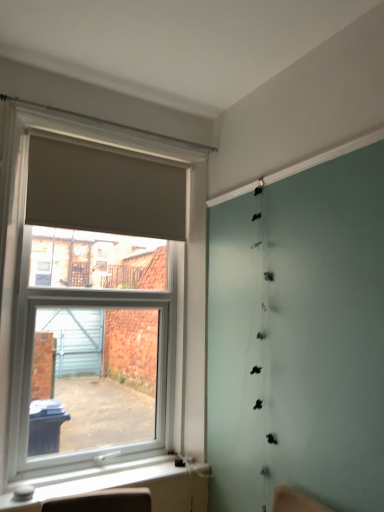
The width and height of the screenshot is (384, 512). In order to click on matte beige curtain at upper left in this screenshot , I will do `click(103, 191)`.

This screenshot has height=512, width=384. I want to click on matte gray roller blind at left, so (x=11, y=283).

Can you confirm if white plastic window sill at lower left is positioned to the left of matte gray roller blind at left?

No.

You are a GUI agent. You are given a task and a screenshot of the screen. Output one action in this format:
    pyautogui.click(x=<x>, y=<y>)
    Task: Click on the window above the white plastic window sill at lower left (from the image's perspective)
    
    Given the screenshot: What is the action you would take?
    pyautogui.click(x=11, y=283)

Could you tell me if white plastic window sill at lower left is facing matte gray roller blind at left?

No, white plastic window sill at lower left is not facing towards matte gray roller blind at left.

Considering the relative positions of matte gray roller blind at left and white plastic window sill at lower left in the image provided, is matte gray roller blind at left in front of white plastic window sill at lower left?

Yes, matte gray roller blind at left is closer to the camera.

From the image's perspective, who appears lower, matte gray roller blind at left or white plastic window sill at lower left?

From the image's view, white plastic window sill at lower left is below.

Does matte gray roller blind at left turn towards white plastic window sill at lower left?

No.

Is matte gray roller blind at left touching matte beige curtain at upper left?

matte gray roller blind at left and matte beige curtain at upper left are clearly separated.

Where is `window below the matte beige curtain at upper left (from a real-world perspective)`? The height and width of the screenshot is (512, 384). window below the matte beige curtain at upper left (from a real-world perspective) is located at coordinates (11, 283).

How many degrees apart are the facing directions of matte gray roller blind at left and matte beige curtain at upper left?

0.00287 degrees.

From a real-world perspective, does matte gray roller blind at left stand above matte beige curtain at upper left?

No, from a real-world perspective, matte gray roller blind at left is not above matte beige curtain at upper left.

Would you say matte beige curtain at upper left is outside white plastic window sill at lower left?

Yes.

Between matte beige curtain at upper left and white plastic window sill at lower left, which one has smaller width?

With smaller width is matte beige curtain at upper left.

From the image's perspective, does matte beige curtain at upper left appear higher than white plastic window sill at lower left?

Yes, from the image's perspective, matte beige curtain at upper left is over white plastic window sill at lower left.

Considering the relative positions of matte beige curtain at upper left and white plastic window sill at lower left in the image provided, is matte beige curtain at upper left to the right of white plastic window sill at lower left from the viewer's perspective?

In fact, matte beige curtain at upper left is to the left of white plastic window sill at lower left.

I want to click on window sill that is under the matte beige curtain at upper left (from a real-world perspective), so click(x=126, y=485).

Consider the image. Does white plastic window sill at lower left touch matte beige curtain at upper left?

No, white plastic window sill at lower left is not in contact with matte beige curtain at upper left.

Between white plastic window sill at lower left and matte beige curtain at upper left, which one has larger width?

white plastic window sill at lower left.

Considering the sizes of objects white plastic window sill at lower left and matte beige curtain at upper left in the image provided, who is smaller, white plastic window sill at lower left or matte beige curtain at upper left?

white plastic window sill at lower left is smaller.

Is matte gray roller blind at left a part of matte beige curtain at upper left?

No, matte gray roller blind at left is not surrounded by matte beige curtain at upper left.

Considering the positions of objects matte beige curtain at upper left and matte gray roller blind at left in the image provided, who is more to the left, matte beige curtain at upper left or matte gray roller blind at left?

matte gray roller blind at left.

From the image's perspective, which is below, matte beige curtain at upper left or matte gray roller blind at left?

matte gray roller blind at left, from the image's perspective.

Locate an element on the screen. This screenshot has height=512, width=384. window sill below the matte gray roller blind at left (from a real-world perspective) is located at coordinates (126, 485).

Where is `window located on the left of white plastic window sill at lower left`? This screenshot has width=384, height=512. window located on the left of white plastic window sill at lower left is located at coordinates (11, 283).

Looking at the image, which one is located further to matte beige curtain at upper left, matte gray roller blind at left or white plastic window sill at lower left?

Based on the image, white plastic window sill at lower left appears to be further to matte beige curtain at upper left.

When comparing their distances from matte gray roller blind at left, does matte beige curtain at upper left or white plastic window sill at lower left seem further?

matte beige curtain at upper left.

Which object lies further to the anchor point matte gray roller blind at left, white plastic window sill at lower left or matte beige curtain at upper left?

matte beige curtain at upper left is further to matte gray roller blind at left.

From the image, which object appears to be farther from white plastic window sill at lower left, matte beige curtain at upper left or matte gray roller blind at left?

Among the two, matte beige curtain at upper left is located further to white plastic window sill at lower left.

When comparing their distances from matte beige curtain at upper left, does white plastic window sill at lower left or matte gray roller blind at left seem further?

white plastic window sill at lower left lies further to matte beige curtain at upper left than the other object.

Based on their spatial positions, is matte gray roller blind at left or matte beige curtain at upper left closer to white plastic window sill at lower left?

matte gray roller blind at left is closer to white plastic window sill at lower left.

The image size is (384, 512). In order to click on window between matte beige curtain at upper left and white plastic window sill at lower left in the vertical direction in this screenshot , I will do `click(11, 283)`.